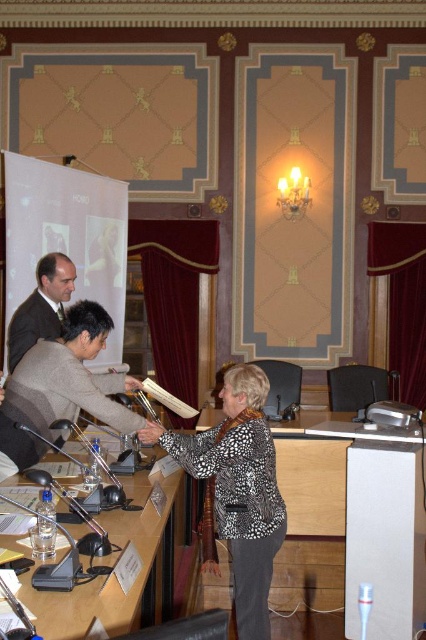
Question: Does wooden table at center have a smaller size compared to printed fabric jacket at center?

Choices:
 (A) no
 (B) yes

Answer: (A)

Question: Estimate the real-world distances between objects in this image. Which object is closer to the dark brown suit at center?

Choices:
 (A) printed fabric jacket at center
 (B) dark gray suit at center
 (C) wooden table at center

Answer: (B)

Question: Does wooden table at center appear over clear plastic table at center?

Choices:
 (A) yes
 (B) no

Answer: (B)

Question: Which point is farther to the camera?

Choices:
 (A) dark gray suit at center
 (B) clear plastic table at center

Answer: (A)

Question: Which object is farther from the camera taking this photo?

Choices:
 (A) dark gray suit at center
 (B) wooden table at center
 (C) dark brown suit at center

Answer: (C)

Question: Does wooden table at center lie in front of dark gray suit at center?

Choices:
 (A) yes
 (B) no

Answer: (B)